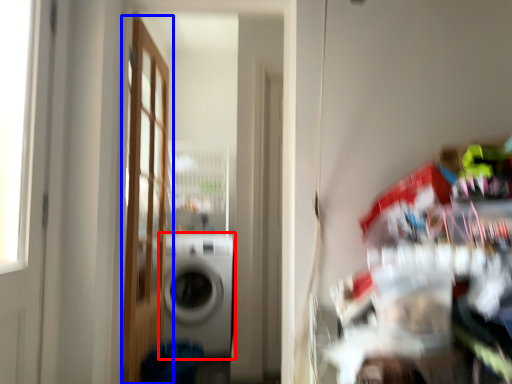
Question: Which object appears closest to the camera in this image, washing machine (highlighted by a red box) or door (highlighted by a blue box)?

Choices:
 (A) washing machine
 (B) door

Answer: (B)